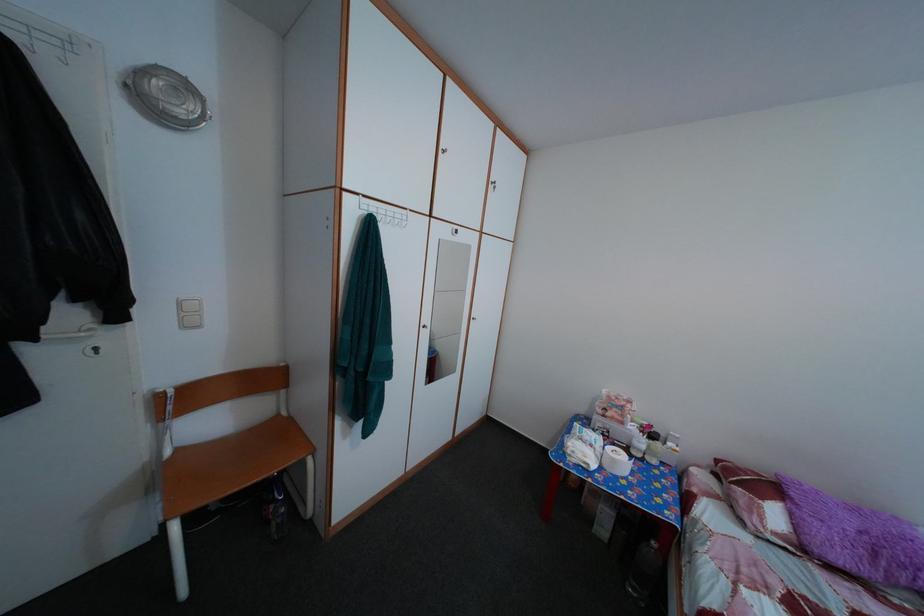
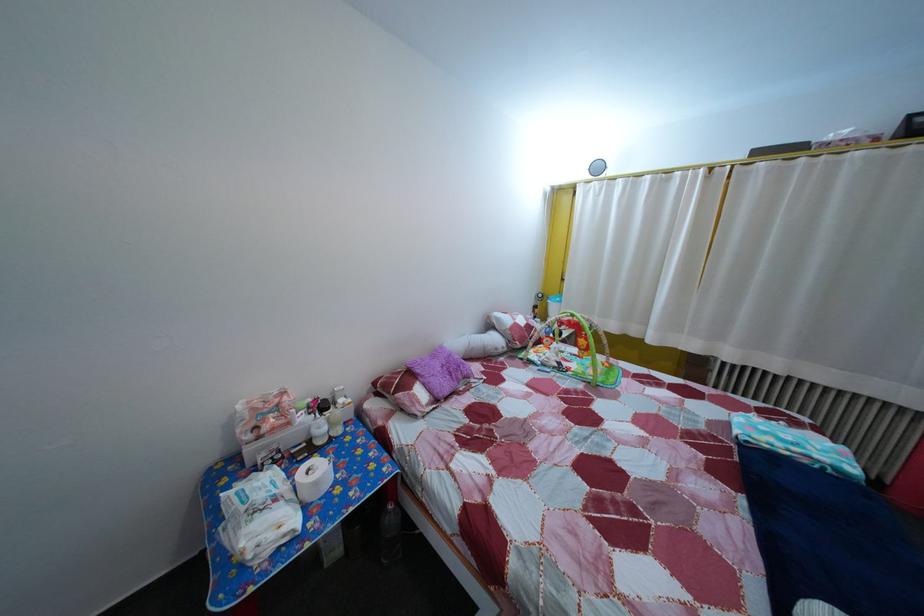
Locate, in the second image, the point that corresponds to point (641, 436) in the first image.

(311, 427)